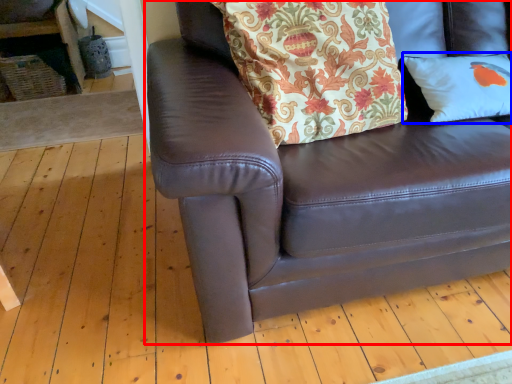
Question: Which point is closer to the camera, studio couch (highlighted by a red box) or pillow (highlighted by a blue box)?

Choices:
 (A) studio couch
 (B) pillow

Answer: (A)